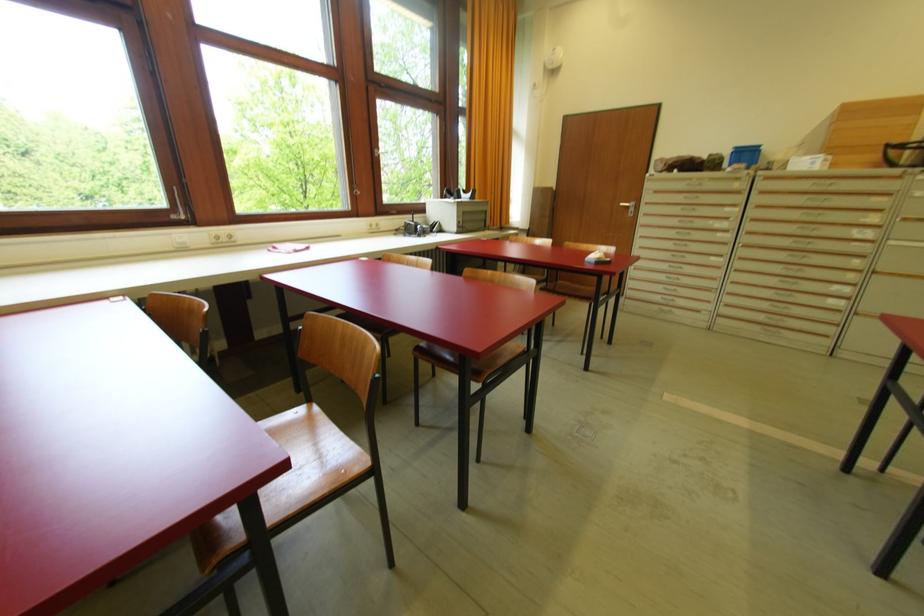
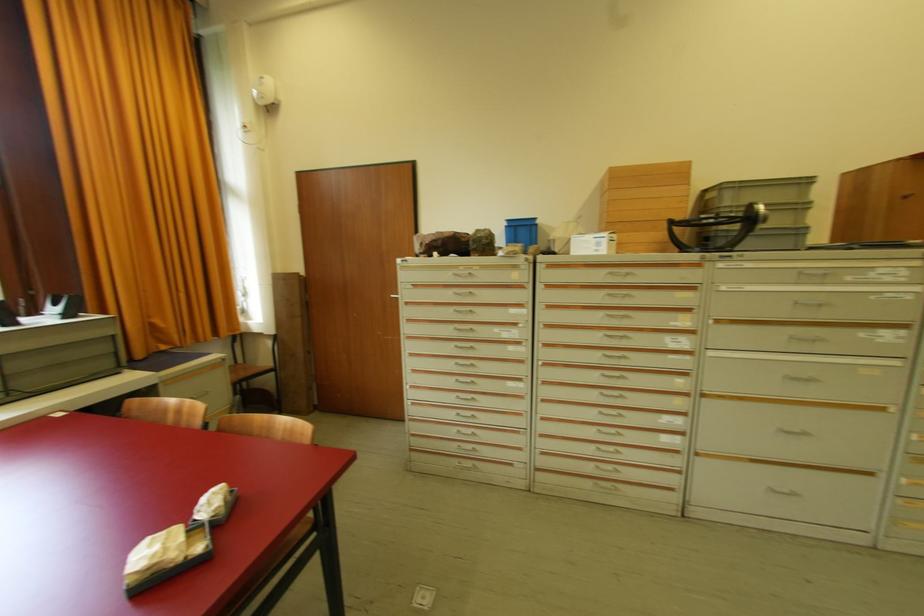
In the second image, find the point that corresponds to the point at 786,171 in the first image.

(570, 254)